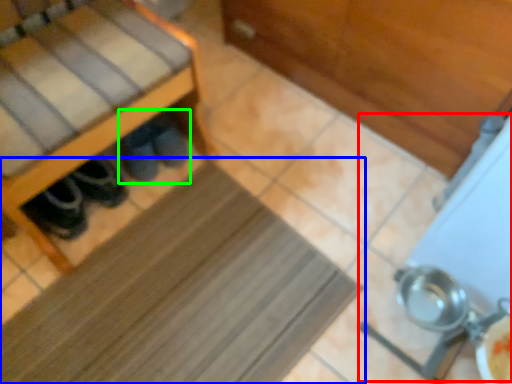
Question: Which object is the closest to the wide (highlighted by a red box)? Choose among these: mat (highlighted by a blue box) or footwear (highlighted by a green box).

Choices:
 (A) mat
 (B) footwear

Answer: (A)